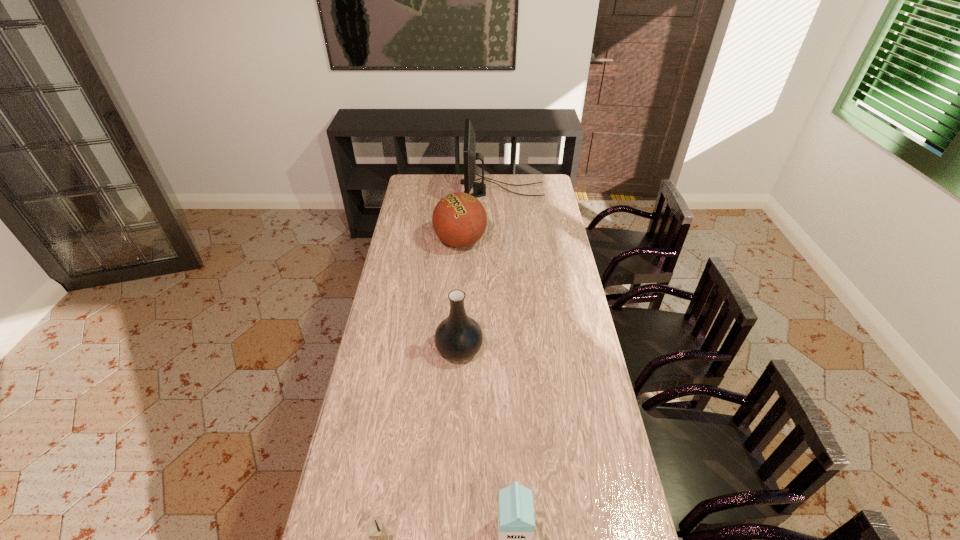
The height and width of the screenshot is (540, 960). Identify the location of object at the right edge. (470, 156).

Identify the location of object located in the far right corner section of the desktop. The width and height of the screenshot is (960, 540). (470, 156).

Where is `free region at the far edge of the desktop`? This screenshot has width=960, height=540. free region at the far edge of the desktop is located at coordinates (525, 187).

Where is `vacant space at the left edge`? vacant space at the left edge is located at coordinates (381, 334).

In order to click on free space at the right edge in this screenshot , I will do `click(577, 302)`.

Identify the location of free space at the far left corner of the desktop. This screenshot has width=960, height=540. (411, 195).

Locate an element on the screen. vacant region at the far right corner of the desktop is located at coordinates (545, 174).

This screenshot has width=960, height=540. In order to click on free space between the farthest object and the vase in this screenshot , I will do `click(480, 269)`.

Locate an element on the screen. This screenshot has width=960, height=540. object that ranks as the third closest to the vase is located at coordinates (377, 532).

Identify the location of object that is the nearest to the second farthest object. The image size is (960, 540). (470, 156).